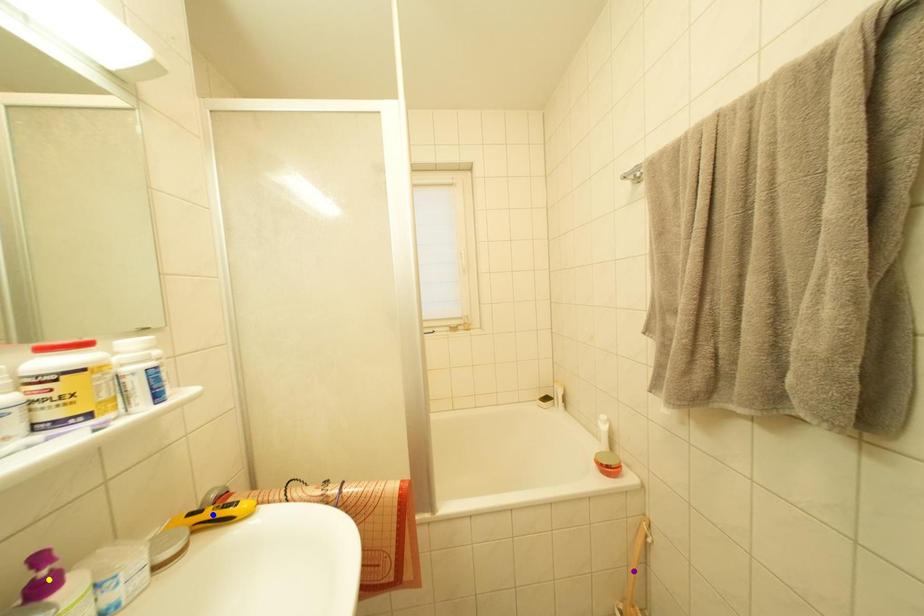
Order these from nearest to farthest:
yellow point | purple point | blue point

yellow point, blue point, purple point